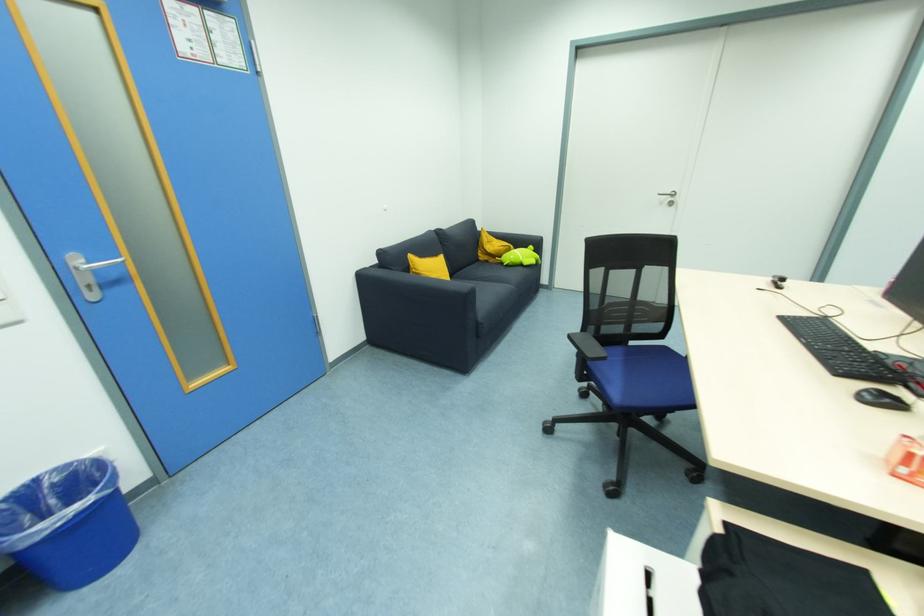
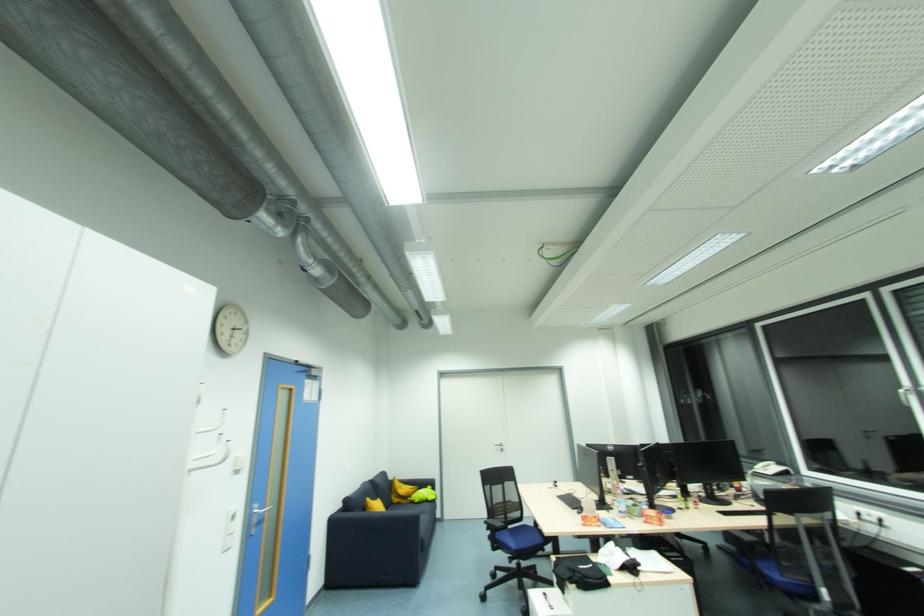
The point at [504,257] is marked in the first image. Where is the corresponding point in the second image?

(412, 499)